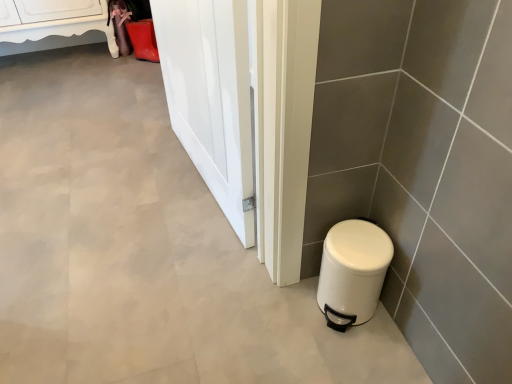
Find the location of a particular element. This screenshot has height=384, width=512. free space that is to the left of white matte trash can at lower right is located at coordinates (281, 310).